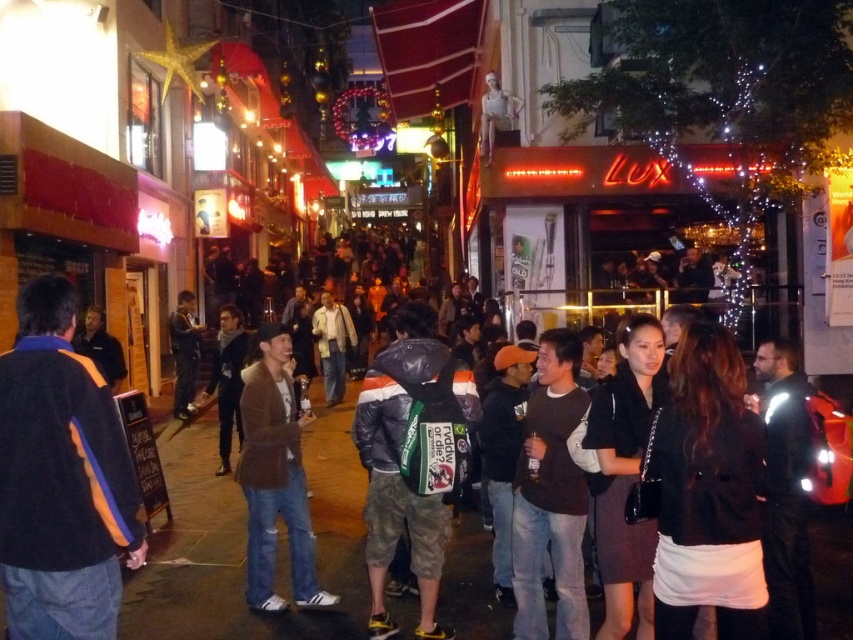
You are a delivery person who needs to locate the dark blue fleece jacket at left. According to the coordinates provided, where exactly is it positioned in the image?

The dark blue fleece jacket at left is located at point (61,477) in the image.

You are a photographer trying to capture both the dark blue fleece jacket at left and the dark blue jeans at center in a single frame. Based on their sizes, which clothing item will appear smaller in your photo?

The dark blue fleece jacket at left will appear smaller in the photo because it has a smaller size compared to the dark blue jeans at center.